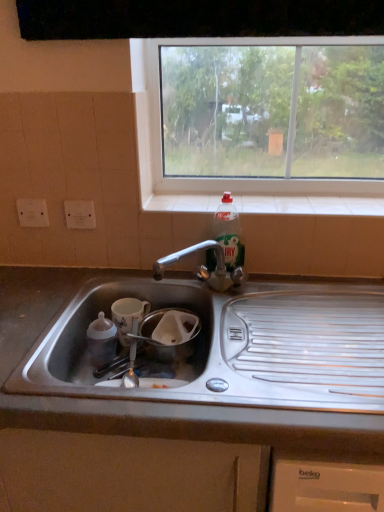
Question: Does translucent plastic bottle at upper right have a lesser width compared to white glossy mug at lower left?

Choices:
 (A) no
 (B) yes

Answer: (B)

Question: Is translucent plastic bottle at upper right facing towards white glossy mug at lower left?

Choices:
 (A) no
 (B) yes

Answer: (A)

Question: Does translucent plastic bottle at upper right touch white glossy mug at lower left?

Choices:
 (A) yes
 (B) no

Answer: (B)

Question: Would you consider translucent plastic bottle at upper right to be distant from white glossy mug at lower left?

Choices:
 (A) no
 (B) yes

Answer: (A)

Question: Is translucent plastic bottle at upper right at the left side of white glossy mug at lower left?

Choices:
 (A) no
 (B) yes

Answer: (A)

Question: Is clear glass window at upper center spatially inside white tile at upper center, or outside of it?

Choices:
 (A) outside
 (B) inside

Answer: (A)

Question: Relative to white tile at upper center, is clear glass window at upper center in front or behind?

Choices:
 (A) front
 (B) behind

Answer: (A)

Question: Is clear glass window at upper center wider or thinner than white tile at upper center?

Choices:
 (A) wide
 (B) thin

Answer: (B)

Question: From a real-world perspective, is clear glass window at upper center above or below white tile at upper center?

Choices:
 (A) below
 (B) above

Answer: (B)

Question: Is point (132, 315) positioned closer to the camera than point (306, 413)?

Choices:
 (A) farther
 (B) closer

Answer: (A)

Question: Choose the correct answer: Is white glossy mug at lower left inside satin steel sink at lower center or outside it?

Choices:
 (A) inside
 (B) outside

Answer: (A)

Question: In terms of width, does white glossy mug at lower left look wider or thinner when compared to satin steel sink at lower center?

Choices:
 (A) wide
 (B) thin

Answer: (B)

Question: From the image's perspective, is white glossy mug at lower left located above or below satin steel sink at lower center?

Choices:
 (A) below
 (B) above

Answer: (B)

Question: Relative to satin steel sink at lower center, is translucent plastic bottle at upper right in front or behind?

Choices:
 (A) behind
 (B) front

Answer: (A)

Question: Is point (231, 248) closer or farther from the camera than point (104, 505)?

Choices:
 (A) closer
 (B) farther

Answer: (B)